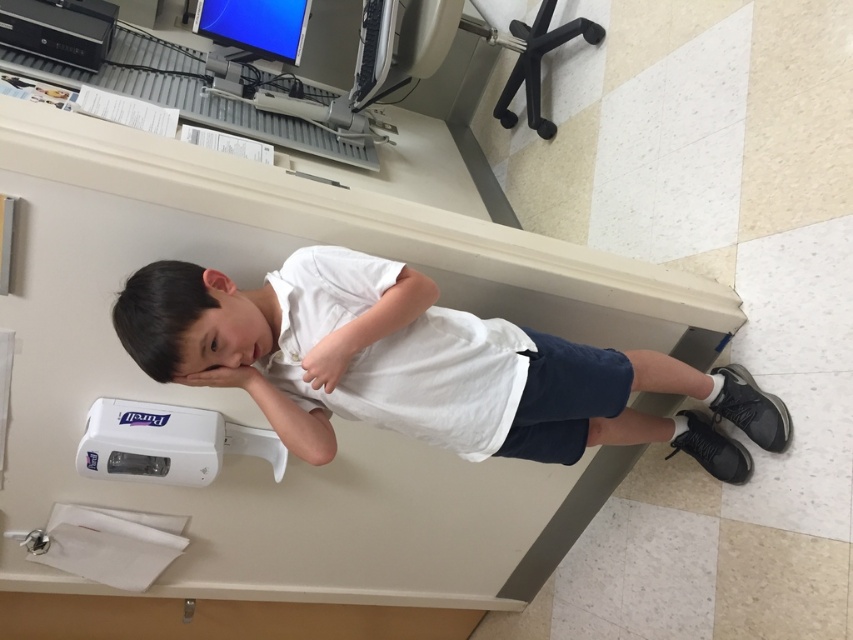
Question: Is white cotton shirt at center above black matte hair at upper center?

Choices:
 (A) yes
 (B) no

Answer: (B)

Question: Can you confirm if white cotton shirt at center is positioned above black matte hair at upper center?

Choices:
 (A) no
 (B) yes

Answer: (A)

Question: Which point appears closest to the camera in this image?

Choices:
 (A) (786, 436)
 (B) (160, 262)

Answer: (B)

Question: Is white cotton shirt at center to the right of black matte hair at upper center from the viewer's perspective?

Choices:
 (A) no
 (B) yes

Answer: (B)